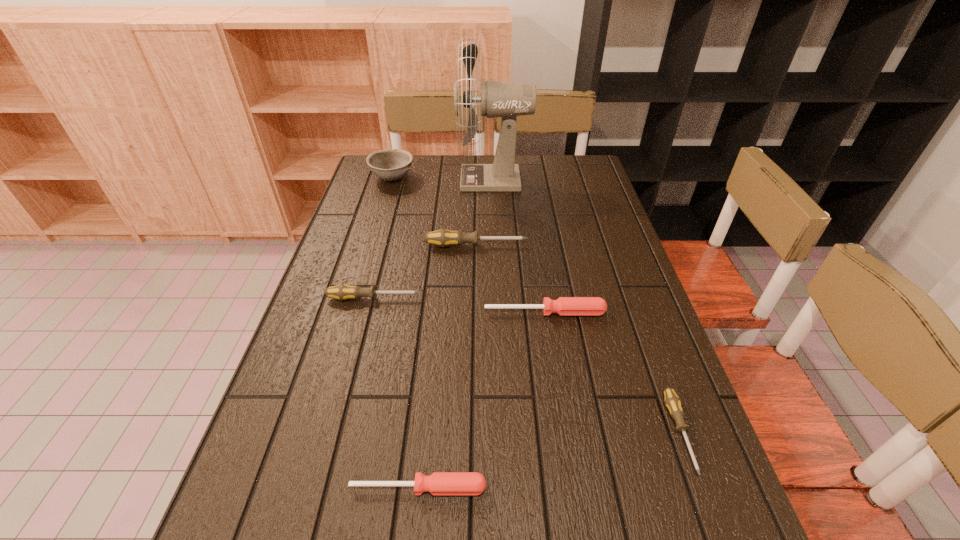
Where is `the tallest object`? the tallest object is located at coordinates (507, 100).

The width and height of the screenshot is (960, 540). Find the location of `gray fan`. gray fan is located at coordinates (507, 100).

Locate an element on the screen. The image size is (960, 540). gray bowl is located at coordinates (390, 164).

Image resolution: width=960 pixels, height=540 pixels. In order to click on the second tallest object in this screenshot , I will do `click(390, 164)`.

In order to click on the fifth nearest object in this screenshot , I will do `click(443, 237)`.

Locate an element on the screen. Image resolution: width=960 pixels, height=540 pixels. the fifth shortest object is located at coordinates (443, 237).

At what (x,y) coordinates should I click in order to perform the action: click on the fourth farthest object. Please return your answer as a coordinate pair (x, y). The height and width of the screenshot is (540, 960). Looking at the image, I should click on (342, 292).

The height and width of the screenshot is (540, 960). I want to click on the second biggest gray screwdriver, so click(x=342, y=292).

The height and width of the screenshot is (540, 960). I want to click on the third farthest screwdriver, so click(x=564, y=306).

Where is `the farther red screwdriver`? Image resolution: width=960 pixels, height=540 pixels. the farther red screwdriver is located at coordinates (564, 306).